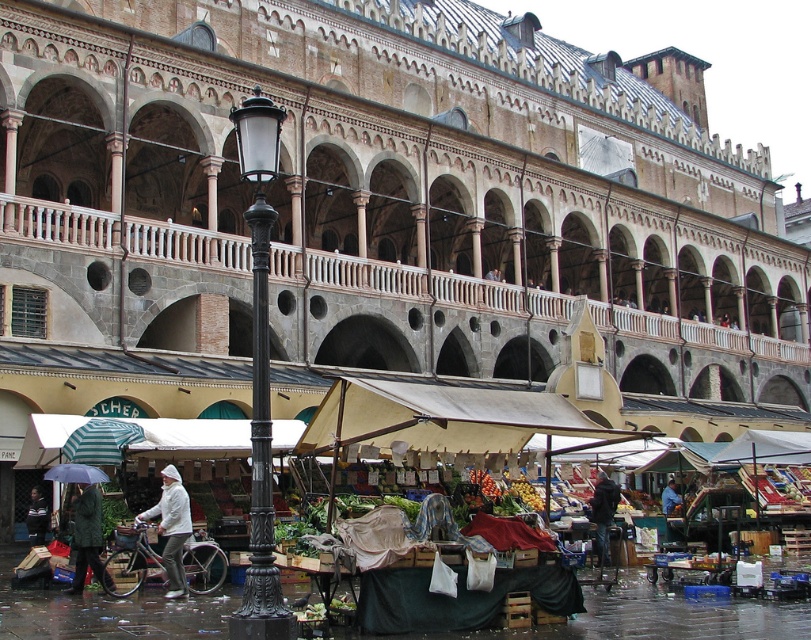
You are a customer at the market and want to try on both the dark blue jacket at lower center and the light brown leather jacket at center. Which jacket will you need a larger size of when purchasing?

The dark blue jacket at lower center is larger in size than the light brown leather jacket at center, so you would need a larger size for the dark blue jacket at lower center.

You are a customer at the market and want to approach both the white matte jacket at center and the camouflage jacket at lower left. Which jacket should you walk towards first to reach the one closer to you?

You should walk towards the white matte jacket at center first because it is closer to you than the camouflage jacket at lower left.